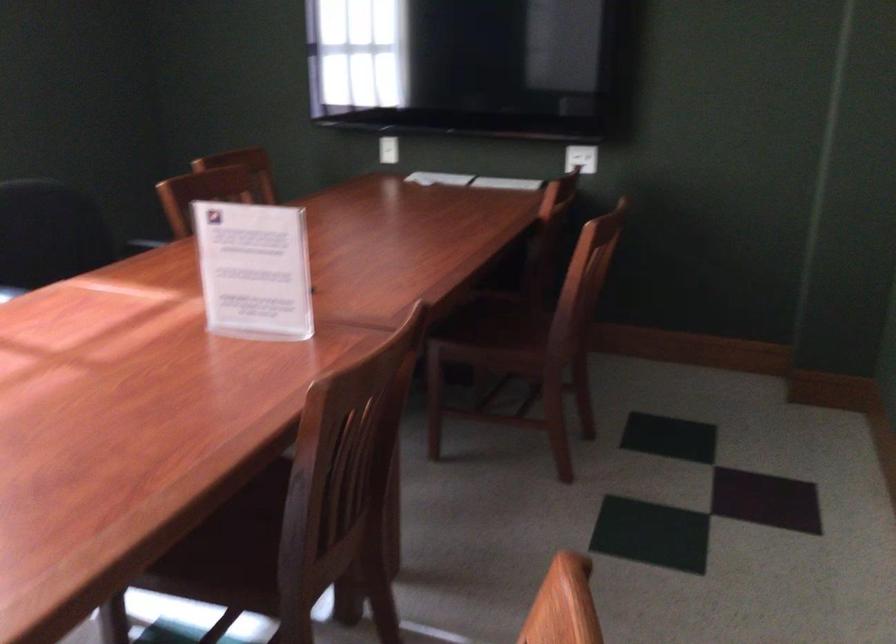
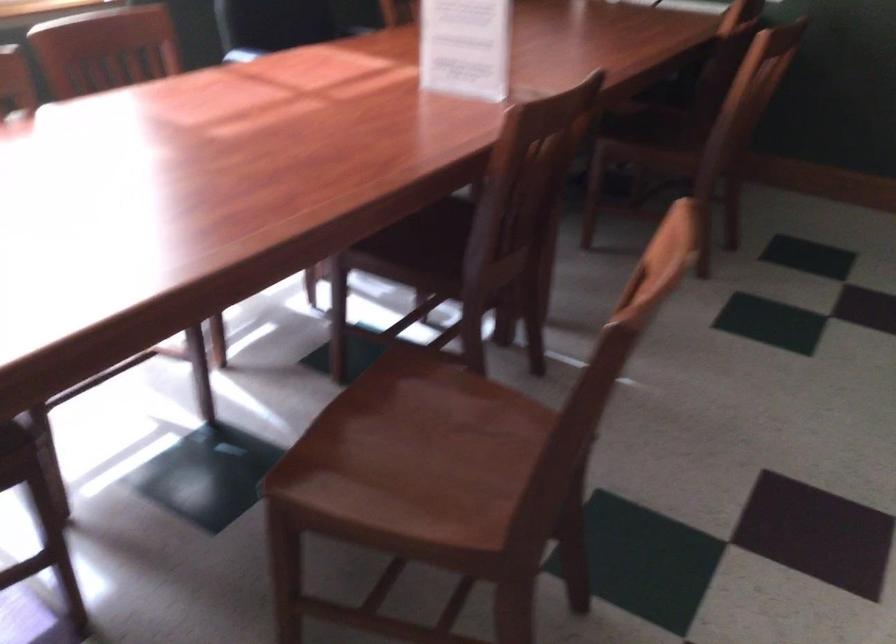
Locate, in the second image, the point that corresponds to point (495, 319) in the first image.

(659, 122)